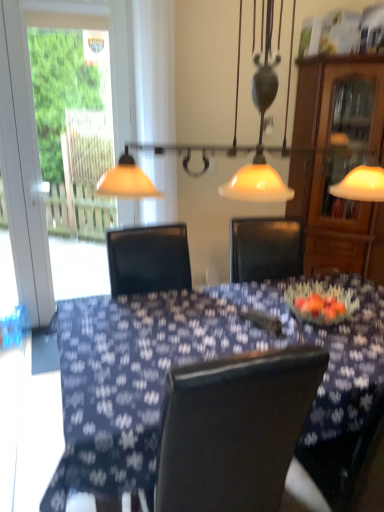
The width and height of the screenshot is (384, 512). Find the location of `empty space that is ontop of blue fabric table at center (from a real-world perspective)`. empty space that is ontop of blue fabric table at center (from a real-world perspective) is located at coordinates (228, 320).